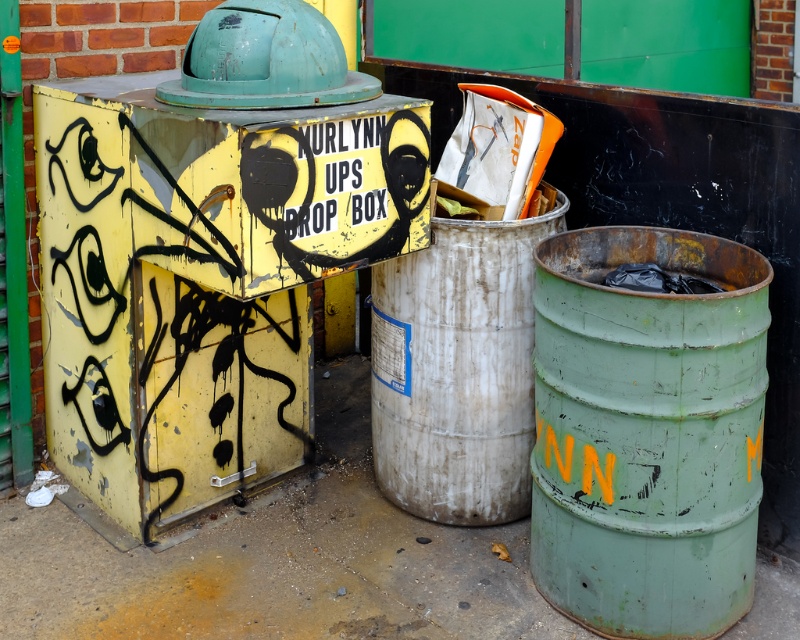
Is point (566, 358) closer to camera compared to point (478, 317)?

Yes, it is in front of point (478, 317).

Is green painted metal barrel at right in front of rusty metallic barrel at center?

Yes.

Image resolution: width=800 pixels, height=640 pixels. What are the coordinates of `green painted metal barrel at right` in the screenshot? It's located at (648, 433).

At what (x,y) coordinates should I click in order to perform the action: click on green painted metal barrel at right. Please return your answer as a coordinate pair (x, y). The image size is (800, 640). Looking at the image, I should click on (648, 433).